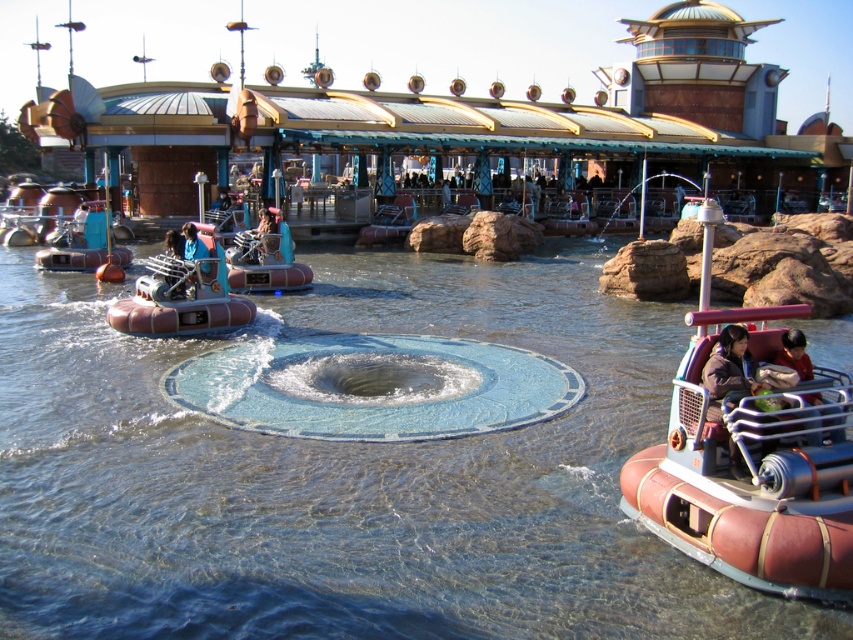
Which is above, brown rubber boat at center or blue fabric person at center?

blue fabric person at center is higher up.

I want to click on brown rubber boat at center, so click(753, 481).

Which is in front, point (227, 312) or point (186, 243)?

Point (227, 312) is more forward.

Is rustic brown hovercraft at center below blue fabric person at center?

Yes, rustic brown hovercraft at center is below blue fabric person at center.

Is point (173, 284) behind point (195, 257)?

No, (173, 284) is in front of (195, 257).

This screenshot has width=853, height=640. I want to click on rustic brown hovercraft at center, so click(x=181, y=298).

Between rustic brown hovercraft at center and matte brown hovercraft at left, which one has more height?

With more height is rustic brown hovercraft at center.

Does point (172, 324) come farther from viewer compared to point (83, 250)?

No, it is not.

Where is `rustic brown hovercraft at center`? The height and width of the screenshot is (640, 853). rustic brown hovercraft at center is located at coordinates (181, 298).